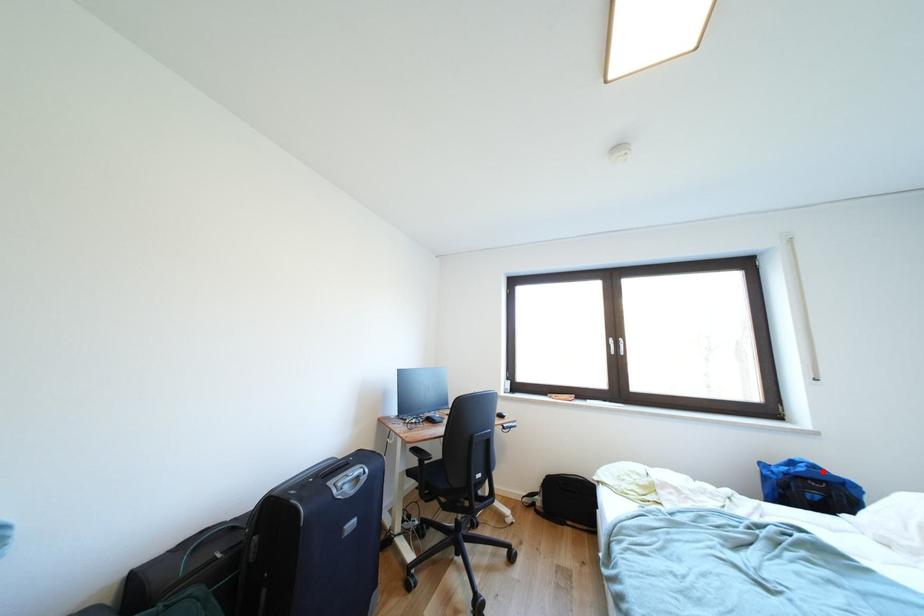
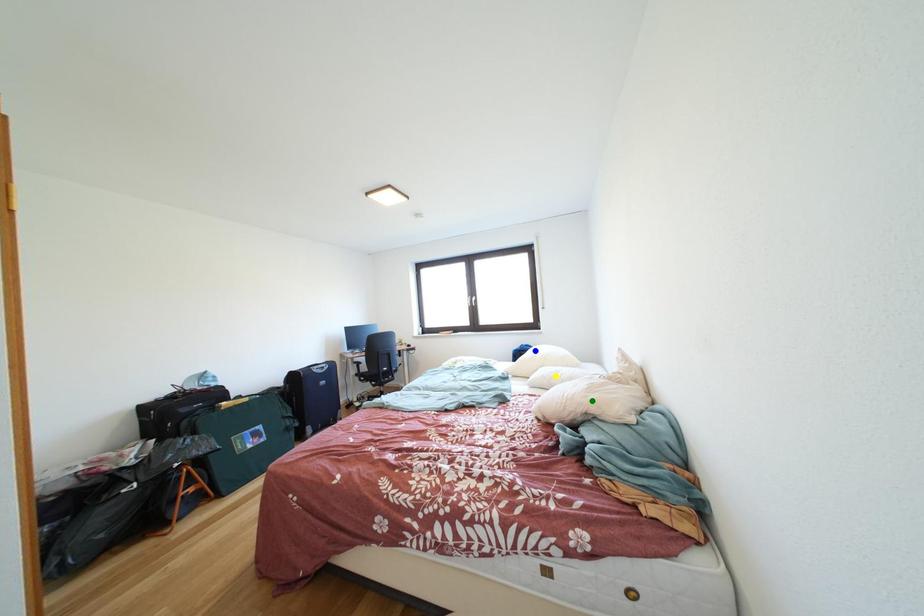
Question: I am providing you with two images of the same scene from different viewpoints. A red point is marked on the first image. You are given multiple points on the second image. Which point in image 2 is actually the same real-world point as the red point in image 1?

Choices:
 (A) yellow point
 (B) blue point
 (C) green point

Answer: (B)